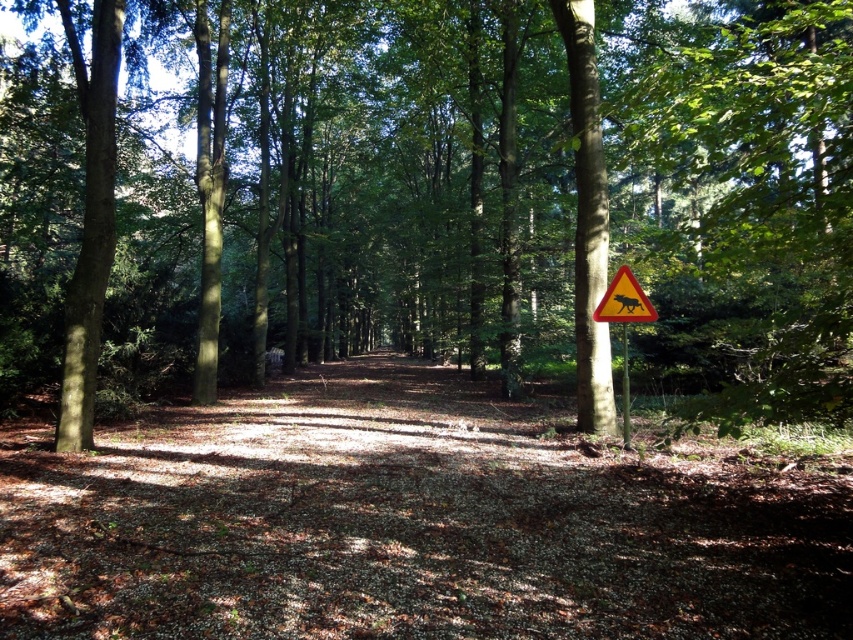
Who is more forward, (84, 378) or (639, 307)?

Point (639, 307)

Which is behind, point (42, 106) or point (599, 314)?

The point (42, 106) is behind.

The height and width of the screenshot is (640, 853). I want to click on green leafy tree at center, so click(445, 193).

Is yellow reflective triangle at upper right closer to the viewer compared to yellow plastic sign at center-right?

Yes, yellow reflective triangle at upper right is closer to the viewer.

Which is more to the right, yellow reflective triangle at upper right or yellow plastic sign at center-right?

From the viewer's perspective, yellow plastic sign at center-right appears more on the right side.

At what (x,y) coordinates should I click in order to perform the action: click on yellow reflective triangle at upper right. Please return your answer as a coordinate pair (x, y). Looking at the image, I should click on (624, 324).

You are a GUI agent. You are given a task and a screenshot of the screen. Output one action in this format:
    pyautogui.click(x=<x>, y=<y>)
    Task: Click on the yellow reflective triangle at upper right
    
    Given the screenshot: What is the action you would take?
    pyautogui.click(x=624, y=324)

Does point (428, 216) come farther from viewer compared to point (637, 284)?

Yes, it is behind point (637, 284).

What do you see at coordinates (445, 193) in the screenshot? The height and width of the screenshot is (640, 853). I see `green leafy tree at center` at bounding box center [445, 193].

Describe the element at coordinates (445, 193) in the screenshot. I see `green leafy tree at center` at that location.

The height and width of the screenshot is (640, 853). I want to click on green leafy tree at center, so click(445, 193).